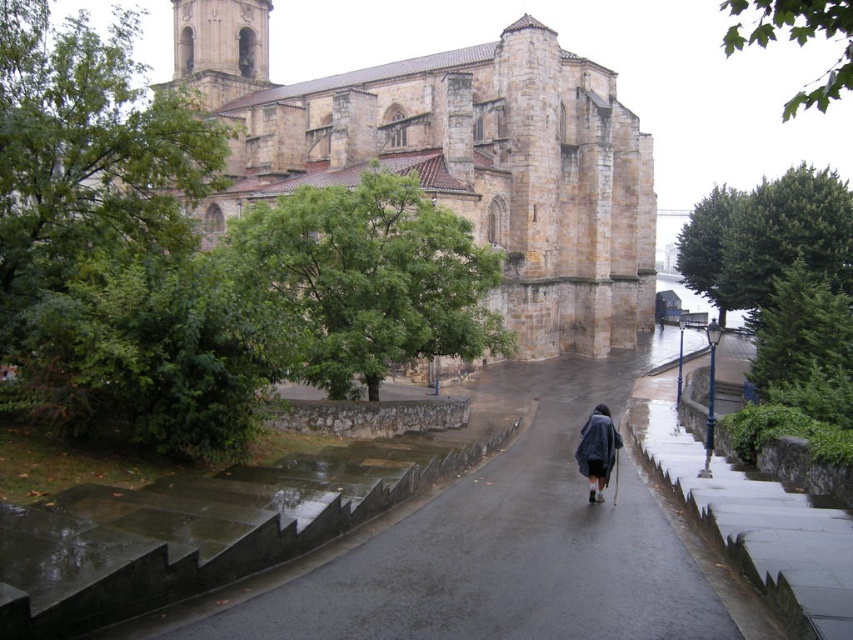
Question: Which object is farther from the camera taking this photo?

Choices:
 (A) smooth asphalt road at center
 (B) brown stone church at upper center

Answer: (B)

Question: Observing the image, what is the correct spatial positioning of smooth asphalt road at center in reference to dark blue fabric coat at center?

Choices:
 (A) right
 (B) left

Answer: (B)

Question: Where is brown stone church at upper center located in relation to dark blue fabric coat at center in the image?

Choices:
 (A) right
 (B) left

Answer: (B)

Question: Is brown stone church at upper center above dark blue fabric coat at center?

Choices:
 (A) no
 (B) yes

Answer: (B)

Question: Which of the following is the farthest from the observer?

Choices:
 (A) brown stone church at upper center
 (B) smooth asphalt road at center

Answer: (A)

Question: Among these points, which one is farthest from the camera?

Choices:
 (A) (602, 404)
 (B) (474, 486)
 (C) (358, 157)

Answer: (C)